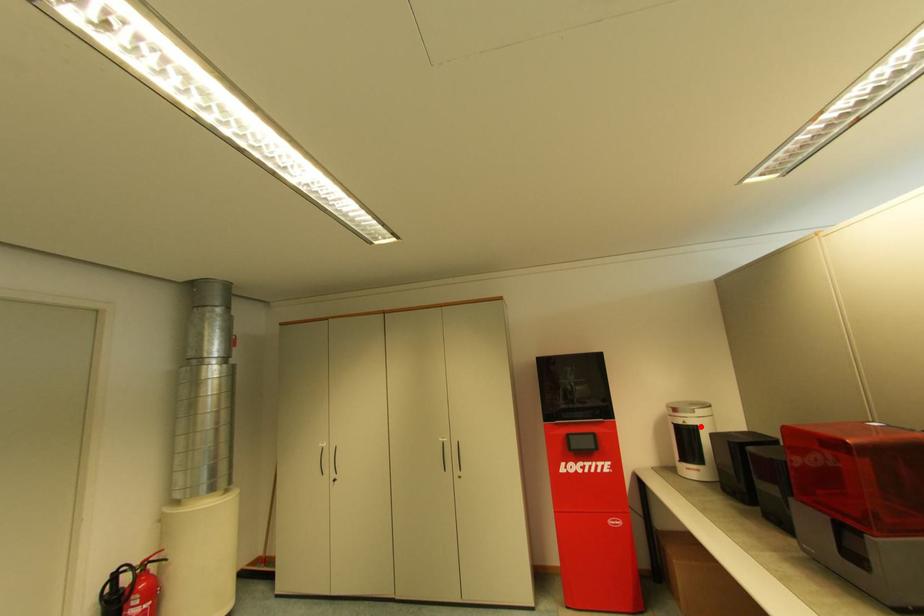
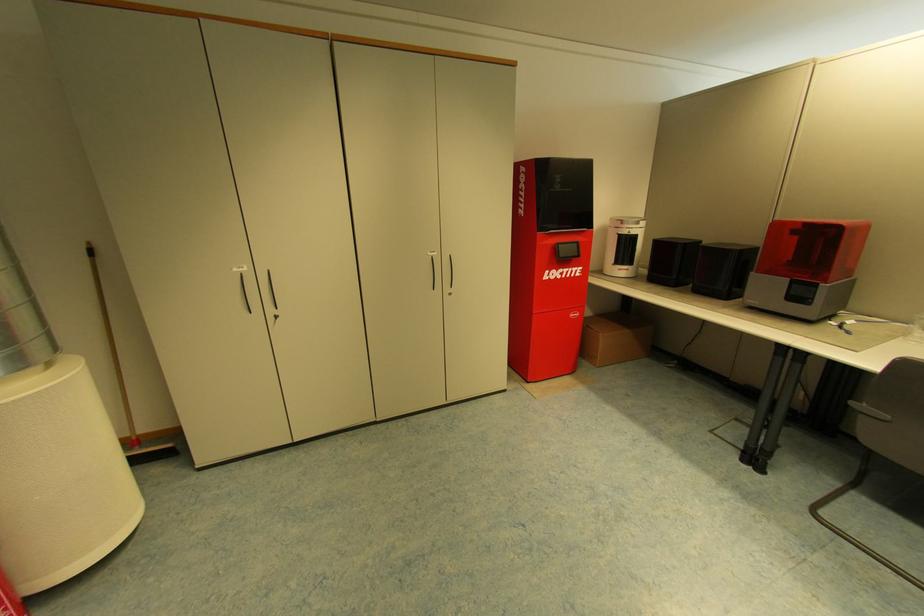
Question: I am providing you with two images of the same scene from different viewpoints. A red point is marked on the first image. At the location where the point appears in image 1, is it still visible in image 2?

Choices:
 (A) Yes
 (B) No

Answer: (A)